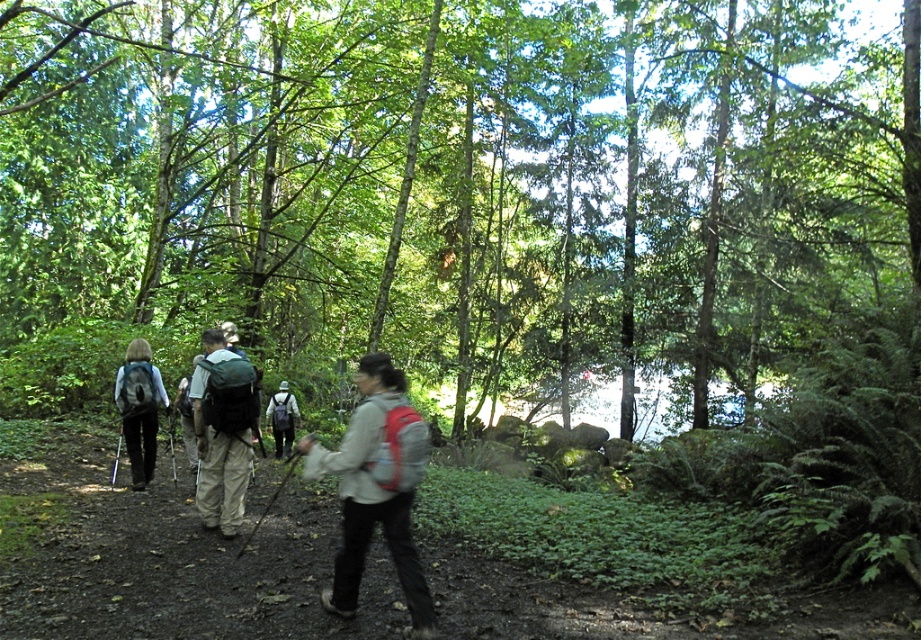
Does green leafy tree at center appear under matte gray backpack at left?

No, green leafy tree at center is not below matte gray backpack at left.

Which is above, green leafy tree at center or matte gray backpack at left?

green leafy tree at center is above.

Is point (389, 314) closer to viewer compared to point (129, 436)?

No, (389, 314) is behind (129, 436).

You are a GUI agent. You are given a task and a screenshot of the screen. Output one action in this format:
    pyautogui.click(x=<x>, y=<y>)
    Task: Click on the green leafy tree at center
    This screenshot has width=921, height=640.
    Given the screenshot: What is the action you would take?
    pyautogui.click(x=453, y=195)

Is point (351, 433) farther from camera compared to point (286, 396)?

No, (351, 433) is in front of (286, 396).

Does matte gray jacket at center appear over matte gray backpack at center?

Yes.

Where is `matte gray jacket at center`? matte gray jacket at center is located at coordinates (377, 490).

This screenshot has height=640, width=921. I want to click on matte gray jacket at center, so click(x=377, y=490).

Does matte green backpack at center have a greater width compared to matte gray backpack at center?

Yes.

What do you see at coordinates (222, 432) in the screenshot? This screenshot has width=921, height=640. I see `matte green backpack at center` at bounding box center [222, 432].

Is point (214, 419) farther from camera compared to point (278, 422)?

No, it is not.

Identify the location of matte green backpack at center. (222, 432).